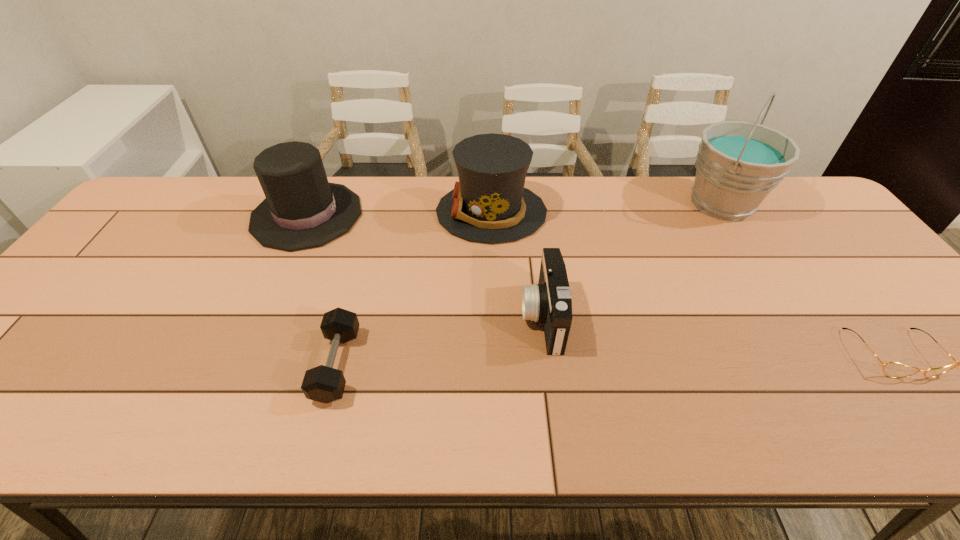
Locate an element on the screen. The width and height of the screenshot is (960, 540). free space located with goggles on the front of the right dress hat is located at coordinates (407, 212).

I want to click on free space located 0.150m on the front of the leftmost object with the decoration, so click(411, 215).

In order to click on vacant position located 0.100m on the lens of the third shortest object in this screenshot , I will do `click(481, 318)`.

Where is `free spot located on the lens of the third shortest object`? The height and width of the screenshot is (540, 960). free spot located on the lens of the third shortest object is located at coordinates (472, 318).

Find the location of `free space located on the lens of the third shortest object`. free space located on the lens of the third shortest object is located at coordinates point(501,318).

The width and height of the screenshot is (960, 540). I want to click on free spot located 0.110m on the back of the dumbbell, so click(x=355, y=294).

Find the location of a particular element. Image resolution: width=960 pixels, height=540 pixels. blank area located 0.060m on the front-facing side of the shortest object is located at coordinates (933, 406).

I want to click on bucket at the far edge, so click(738, 164).

Identify the location of object situated at the near edge. (325, 384).

The height and width of the screenshot is (540, 960). What are the coordinates of `object that is at the right edge` in the screenshot? It's located at (891, 369).